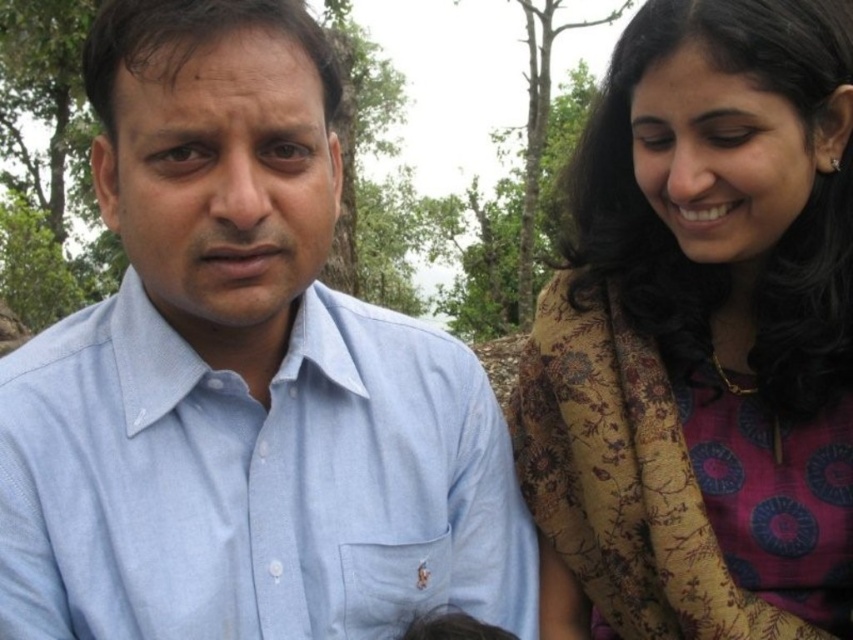
Question: Which point appears farthest from the camera in this image?

Choices:
 (A) (15, 611)
 (B) (750, 273)

Answer: (B)

Question: Among these objects, which one is farthest from the camera?

Choices:
 (A) floral fabric scarf at upper right
 (B) light blue cotton shirt at center

Answer: (A)

Question: Does light blue cotton shirt at center appear under floral fabric scarf at upper right?

Choices:
 (A) yes
 (B) no

Answer: (A)

Question: Is light blue cotton shirt at center thinner than floral fabric scarf at upper right?

Choices:
 (A) no
 (B) yes

Answer: (A)

Question: Does light blue cotton shirt at center come behind floral fabric scarf at upper right?

Choices:
 (A) yes
 (B) no

Answer: (B)